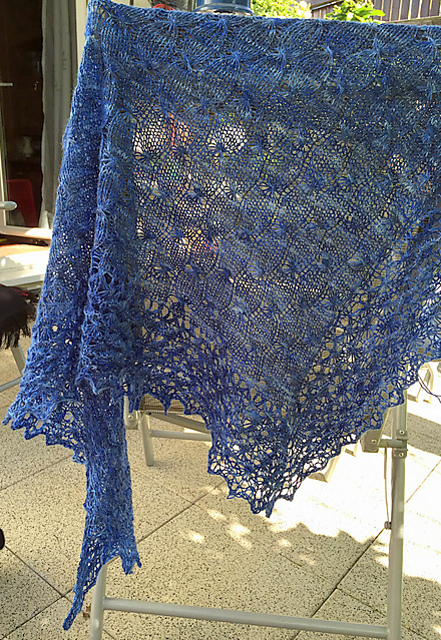
Locate an element on the screen. tile is located at coordinates (29, 595).